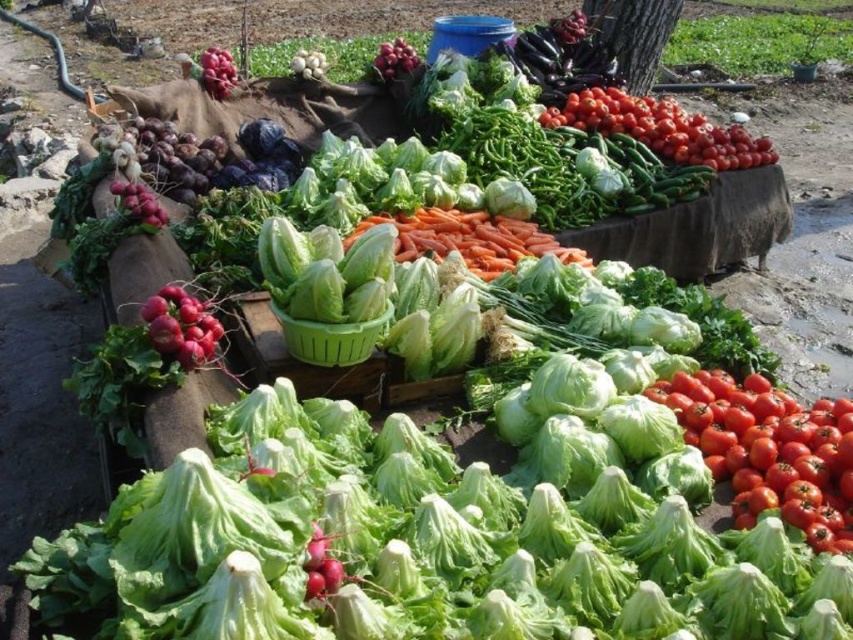
From the picture: You are a customer at the market and want to pick up the shiny purple grapes at upper left. Are they easy to reach without moving the orange smooth carrots at center?

The orange smooth carrots at center are in front of the shiny purple grapes at upper left, so you would need to move the carrots to access the grapes.

Based on the photo, you are a customer at the market and want to buy the widest vegetable between the red matte tomatoes at lower right and the matte red onion at upper center. Which one should you choose?

The red matte tomatoes at lower right are wider than the matte red onion at upper center, so you should choose the red matte tomatoes at lower right.